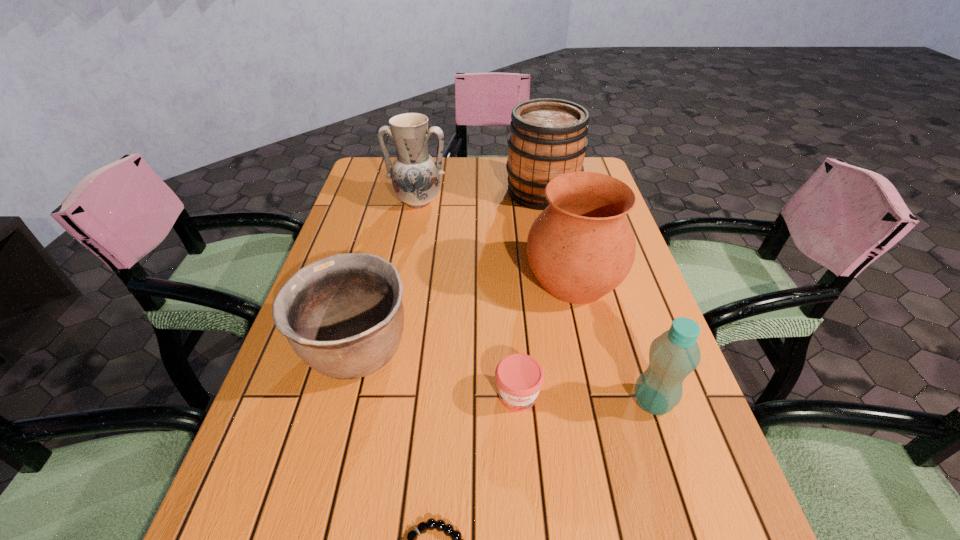
I want to click on object located at the far right corner, so pos(548,138).

This screenshot has width=960, height=540. In the image, there is a desktop. Find the location of `vacant space at the far edge`. vacant space at the far edge is located at coordinates (500, 166).

The height and width of the screenshot is (540, 960). What are the coordinates of `vacant region at the left edge` in the screenshot? It's located at (326, 414).

Locate an element on the screen. The width and height of the screenshot is (960, 540). free region at the right edge of the desktop is located at coordinates click(x=609, y=299).

The image size is (960, 540). In order to click on vacant region at the far left corner of the desktop in this screenshot , I will do `click(375, 170)`.

The height and width of the screenshot is (540, 960). I want to click on vacant point located between the rightmost pottery and the farthest pottery, so click(495, 241).

Locate an element on the screen. The height and width of the screenshot is (540, 960). vacant region between the rightmost pottery and the water bottle is located at coordinates (613, 341).

What are the coordinates of `vacant area between the shortest pottery and the jam` in the screenshot? It's located at (437, 374).

You are a GUI agent. You are given a task and a screenshot of the screen. Output one action in this format:
    pyautogui.click(x=<x>, y=<y>)
    Task: Click on the vacant area that lies between the jam and the shortest pottery
    The image size is (960, 540).
    Given the screenshot: What is the action you would take?
    pyautogui.click(x=437, y=374)

Locate an element on the screen. The height and width of the screenshot is (540, 960). free space between the jam and the cider is located at coordinates (530, 293).